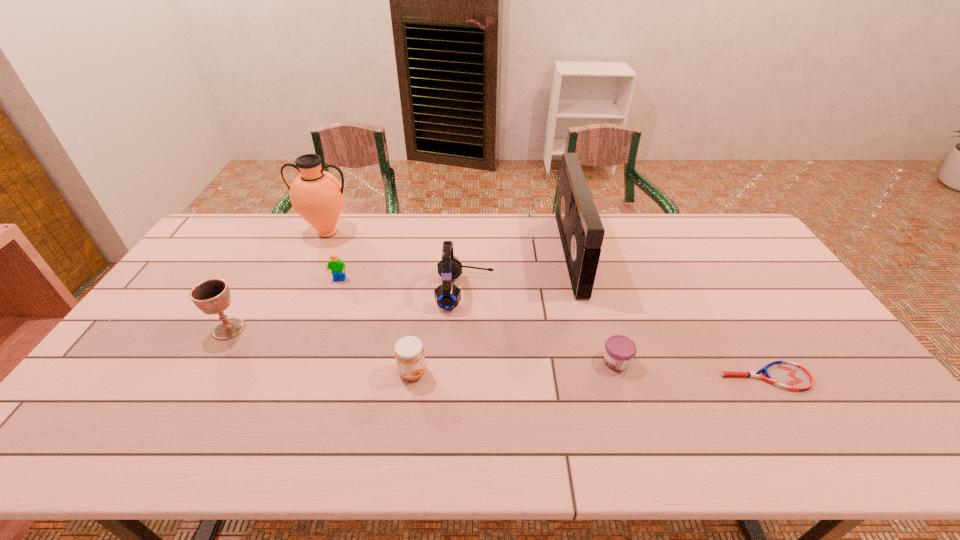
Point out which object is positioned as the nearest to the fourth object from right to left. Please provide its 2D coordinates. Your answer should be formatted as a tuple, i.e. [(x, y)], where the tuple contains the x and y coordinates of a point satisfying the conditions above.

[(409, 353)]

Identify which object is the second closest to the rightmost object. Please provide its 2D coordinates. Your answer should be formatted as a tuple, i.e. [(x, y)], where the tuple contains the x and y coordinates of a point satisfying the conditions above.

[(581, 231)]

Find the location of a particular element. The image size is (960, 540). vacant area in the image that satisfies the following two spatial constraints: 1. on the front label of the rightmost object; 2. on the right side of the fifth object from right to left is located at coordinates (412, 377).

Locate an element on the screen. free spot that satisfies the following two spatial constraints: 1. on the front side of the videotape; 2. on the face of the Lego is located at coordinates (578, 280).

The width and height of the screenshot is (960, 540). Identify the location of vacant position in the image that satisfies the following two spatial constraints: 1. on the front side of the shortest object; 2. on the right side of the videotape. (602, 377).

The height and width of the screenshot is (540, 960). I want to click on vacant region that satisfies the following two spatial constraints: 1. on the front side of the tennis racket; 2. on the left side of the videotape, so click(x=602, y=377).